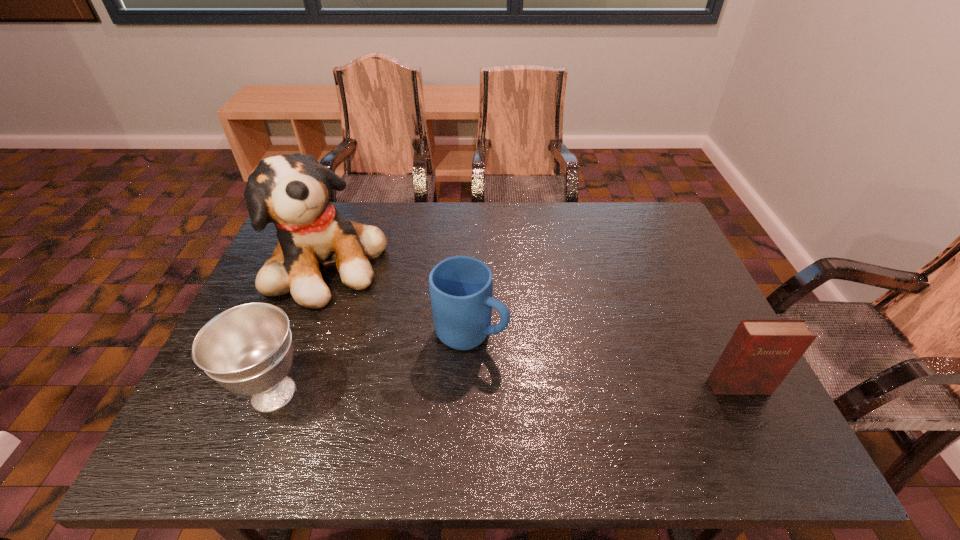
Identify the location of vacant area located 0.080m on the side of the second object from right to left with the handle. (530, 362).

You are a GUI agent. You are given a task and a screenshot of the screen. Output one action in this format:
    pyautogui.click(x=<x>, y=<y>)
    Task: Click on the free point located 0.240m on the side of the second object from right to left with the handle
    Image resolution: width=960 pixels, height=540 pixels.
    Given the screenshot: What is the action you would take?
    pyautogui.click(x=593, y=397)

Locate an element on the screen. Image resolution: width=960 pixels, height=540 pixels. object positioned at the far edge is located at coordinates (292, 191).

The height and width of the screenshot is (540, 960). Identify the location of chalice that is at the near edge. (247, 349).

At what (x,y) coordinates should I click in order to perform the action: click on diary at the near edge. Please return your answer as a coordinate pair (x, y). This screenshot has width=960, height=540. Looking at the image, I should click on 761,352.

Where is `chalice situated at the left edge`? chalice situated at the left edge is located at coordinates (247, 349).

Where is `puppy that is at the left edge`? This screenshot has height=540, width=960. puppy that is at the left edge is located at coordinates (292, 191).

Where is `object present at the right edge`? The height and width of the screenshot is (540, 960). object present at the right edge is located at coordinates (761, 352).

Identify the location of object positioned at the far left corner. The width and height of the screenshot is (960, 540). (292, 191).

This screenshot has height=540, width=960. I want to click on object present at the near left corner, so click(247, 349).